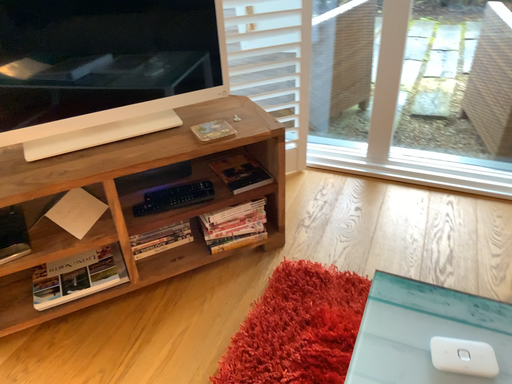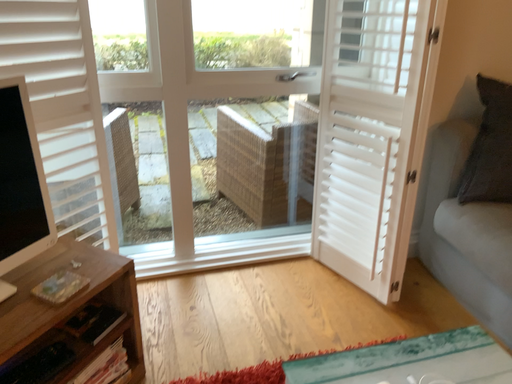
Question: How did the camera likely rotate when shooting the video?

Choices:
 (A) rotated upward
 (B) rotated downward

Answer: (A)